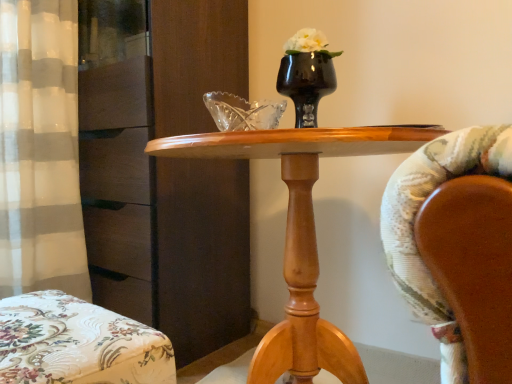
Question: Is point (311, 72) closer or farther from the camera than point (146, 190)?

Choices:
 (A) farther
 (B) closer

Answer: (B)

Question: Based on their positions, is black glossy vase at center located to the left or right of matte brown dresser at left?

Choices:
 (A) right
 (B) left

Answer: (A)

Question: Estimate the real-world distances between objects in this image. Which object is farther from the wooden table at center?

Choices:
 (A) floral fabric ottoman at lower left
 (B) matte brown dresser at left
 (C) black glossy vase at center

Answer: (B)

Question: Which is nearer to the black glossy vase at center?

Choices:
 (A) floral fabric ottoman at lower left
 (B) wooden table at center
 (C) matte brown dresser at left

Answer: (B)